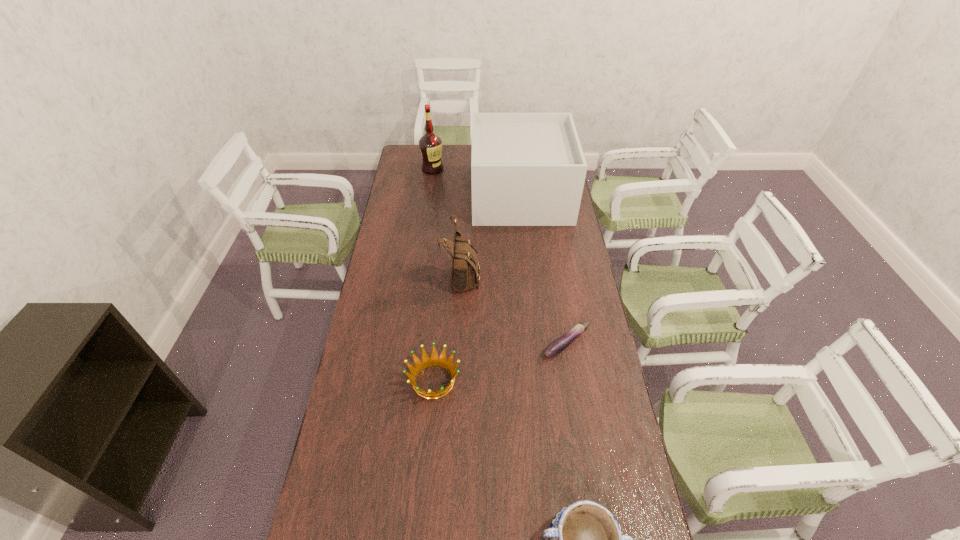
The image size is (960, 540). In order to click on vacant position in the image that satisfies the following two spatial constraints: 1. on the label of the eggplant; 2. on the right side of the alcohol in this screenshot , I will do `click(409, 344)`.

Find the location of a particular element. vacant space that satisfies the following two spatial constraints: 1. on the front-facing side of the fourth nearest object; 2. on the front side of the crown is located at coordinates (457, 381).